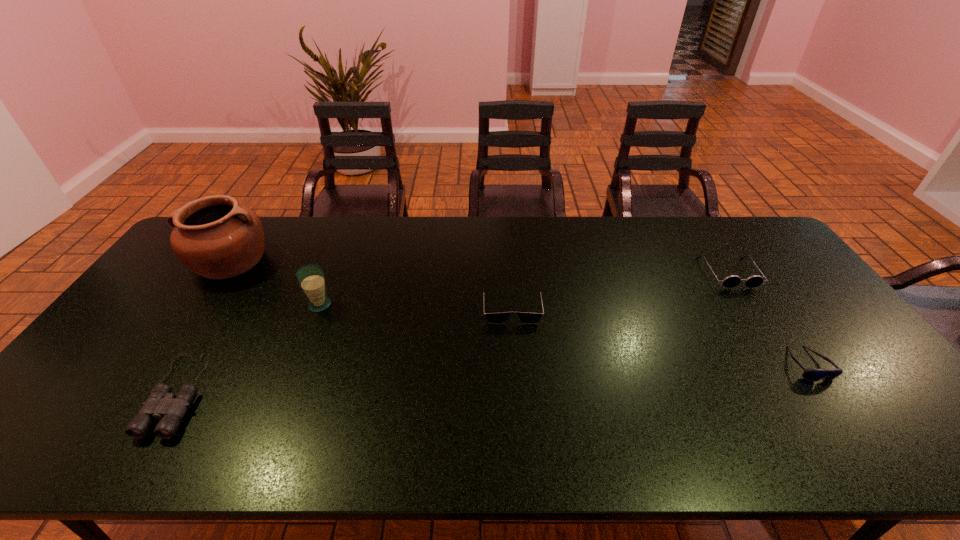
The width and height of the screenshot is (960, 540). In order to click on pottery that is at the far edge in this screenshot , I will do `click(214, 236)`.

At what (x,y) coordinates should I click in order to perform the action: click on sunglasses that is positioned at the far edge. Please return your answer as a coordinate pair (x, y). The image size is (960, 540). Looking at the image, I should click on (731, 281).

This screenshot has height=540, width=960. Find the location of `object situated at the near edge`. object situated at the near edge is located at coordinates (160, 404).

Identify the location of object that is at the left edge. (214, 236).

This screenshot has width=960, height=540. I want to click on object that is positioned at the far left corner, so click(x=214, y=236).

The width and height of the screenshot is (960, 540). I want to click on object that is at the far right corner, so click(731, 281).

In the image, there is a desktop. Identify the location of free space at the far edge. (373, 239).

In the image, there is a desktop. At what (x,y) coordinates should I click in order to perform the action: click on free space at the near edge. Please return your answer as a coordinate pair (x, y). The image size is (960, 540). Looking at the image, I should click on (300, 451).

In the image, there is a desktop. Where is `vacant space at the left edge`? Image resolution: width=960 pixels, height=540 pixels. vacant space at the left edge is located at coordinates 153,327.

Where is `vacant space at the right edge of the desktop`? The image size is (960, 540). vacant space at the right edge of the desktop is located at coordinates (848, 389).